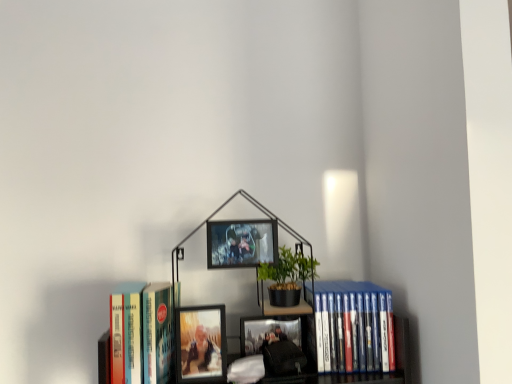
The image size is (512, 384). What do you see at coordinates (353, 327) in the screenshot? I see `blue plastic dvds at right, which is the second book from left to right` at bounding box center [353, 327].

What is the approximate height of matte glass photo frame at center, which ranks as the first picture frame in bottom-to-top order?

It is 14.72 centimeters.

What do you see at coordinates (141, 333) in the screenshot? I see `hardcover book at left, marked as the 1th book in a left-to-right arrangement` at bounding box center [141, 333].

What are the coordinates of `blue plastic dvds at right, which is the second book from left to right` in the screenshot? It's located at (353, 327).

Considering the relative sizes of hardcover book at left, marked as the 1th book in a left-to-right arrangement, and blue plastic dvds at right, the first book in the right-to-left sequence, in the image provided, is hardcover book at left, marked as the 1th book in a left-to-right arrangement, bigger than blue plastic dvds at right, the first book in the right-to-left sequence,?

Yes, hardcover book at left, marked as the 1th book in a left-to-right arrangement, is bigger than blue plastic dvds at right, the first book in the right-to-left sequence.

Does hardcover book at left, placed as the second book when sorted from right to left, appear on the right side of blue plastic dvds at right, which is the second book from left to right?

In fact, hardcover book at left, placed as the second book when sorted from right to left, is to the left of blue plastic dvds at right, which is the second book from left to right.

From a real-world perspective, is hardcover book at left, marked as the 1th book in a left-to-right arrangement, physically located above or below blue plastic dvds at right, the first book in the right-to-left sequence?

hardcover book at left, marked as the 1th book in a left-to-right arrangement, is above blue plastic dvds at right, the first book in the right-to-left sequence.

What's the angular difference between hardcover book at left, placed as the second book when sorted from right to left, and blue plastic dvds at right, the first book in the right-to-left sequence,'s facing directions?

They differ by 5.55 degrees in their facing directions.

Is hardcover book at left, placed as the second book when sorted from right to left, not close to matte glass photo frame at center, the 2th picture frame in the top-to-bottom sequence?

Actually, hardcover book at left, placed as the second book when sorted from right to left, and matte glass photo frame at center, the 2th picture frame in the top-to-bottom sequence, are a little close together.

Is hardcover book at left, marked as the 1th book in a left-to-right arrangement, taller than matte glass photo frame at center, the 2th picture frame in the top-to-bottom sequence?

Indeed, hardcover book at left, marked as the 1th book in a left-to-right arrangement, has a greater height compared to matte glass photo frame at center, the 2th picture frame in the top-to-bottom sequence.

From the hardcover book at left, placed as the second book when sorted from right to left, count 1st picture frame to the right and point to it. Please provide its 2D coordinates.

[(201, 344)]

Is blue plastic dvds at right, the first book in the right-to-left sequence, positioned with its back to metallic silver picture frame at center, marked as the 2th picture frame in a bottom-to-top arrangement?

No, blue plastic dvds at right, the first book in the right-to-left sequence, is not facing the opposite direction of metallic silver picture frame at center, marked as the 2th picture frame in a bottom-to-top arrangement.

Is blue plastic dvds at right, the first book in the right-to-left sequence, to the right of metallic silver picture frame at center, which is the 1th picture frame from top to bottom, from the viewer's perspective?

Correct, you'll find blue plastic dvds at right, the first book in the right-to-left sequence, to the right of metallic silver picture frame at center, which is the 1th picture frame from top to bottom.

In the image, is blue plastic dvds at right, which is the second book from left to right, positioned in front of or behind metallic silver picture frame at center, which is the 1th picture frame from top to bottom?

blue plastic dvds at right, which is the second book from left to right, is positioned farther from the viewer than metallic silver picture frame at center, which is the 1th picture frame from top to bottom.

Do you think blue plastic dvds at right, the first book in the right-to-left sequence, is within metallic silver picture frame at center, marked as the 2th picture frame in a bottom-to-top arrangement, or outside of it?

blue plastic dvds at right, the first book in the right-to-left sequence, is outside metallic silver picture frame at center, marked as the 2th picture frame in a bottom-to-top arrangement.

Between matte glass photo frame at center, the 2th picture frame in the top-to-bottom sequence, and metallic silver picture frame at center, which is the 1th picture frame from top to bottom, which one has more height?

matte glass photo frame at center, the 2th picture frame in the top-to-bottom sequence.

Would you say matte glass photo frame at center, which ranks as the first picture frame in bottom-to-top order, is outside metallic silver picture frame at center, which is the 1th picture frame from top to bottom?

That's correct, matte glass photo frame at center, which ranks as the first picture frame in bottom-to-top order, is outside of metallic silver picture frame at center, which is the 1th picture frame from top to bottom.

Which is nearer, (218, 351) or (267, 238)?

Positioned in front is point (218, 351).

What's the angular difference between matte glass photo frame at center, which ranks as the first picture frame in bottom-to-top order, and metallic silver picture frame at center, marked as the 2th picture frame in a bottom-to-top arrangement,'s facing directions?

0.000105 degrees separate the facing orientations of matte glass photo frame at center, which ranks as the first picture frame in bottom-to-top order, and metallic silver picture frame at center, marked as the 2th picture frame in a bottom-to-top arrangement.

Considering the sizes of objects hardcover book at left, placed as the second book when sorted from right to left, and metallic silver picture frame at center, which is the 1th picture frame from top to bottom, in the image provided, who is taller, hardcover book at left, placed as the second book when sorted from right to left, or metallic silver picture frame at center, which is the 1th picture frame from top to bottom,?

hardcover book at left, placed as the second book when sorted from right to left.

Do you think hardcover book at left, placed as the second book when sorted from right to left, is within metallic silver picture frame at center, marked as the 2th picture frame in a bottom-to-top arrangement, or outside of it?

hardcover book at left, placed as the second book when sorted from right to left, is outside metallic silver picture frame at center, marked as the 2th picture frame in a bottom-to-top arrangement.

Relative to metallic silver picture frame at center, which is the 1th picture frame from top to bottom, is hardcover book at left, placed as the second book when sorted from right to left, in front or behind?

hardcover book at left, placed as the second book when sorted from right to left, is in front of metallic silver picture frame at center, which is the 1th picture frame from top to bottom.

Between matte glass photo frame at center, the 2th picture frame in the top-to-bottom sequence, and hardcover book at left, placed as the second book when sorted from right to left, which one has larger size?

Bigger between the two is hardcover book at left, placed as the second book when sorted from right to left.

Is matte glass photo frame at center, which ranks as the first picture frame in bottom-to-top order, aimed at hardcover book at left, marked as the 1th book in a left-to-right arrangement?

No, matte glass photo frame at center, which ranks as the first picture frame in bottom-to-top order, is not aimed at hardcover book at left, marked as the 1th book in a left-to-right arrangement.

Visually, is matte glass photo frame at center, which ranks as the first picture frame in bottom-to-top order, positioned to the left or to the right of hardcover book at left, marked as the 1th book in a left-to-right arrangement?

Based on their positions, matte glass photo frame at center, which ranks as the first picture frame in bottom-to-top order, is located to the right of hardcover book at left, marked as the 1th book in a left-to-right arrangement.

From the image's perspective, who appears lower, matte glass photo frame at center, which ranks as the first picture frame in bottom-to-top order, or hardcover book at left, placed as the second book when sorted from right to left?

From the image's view, matte glass photo frame at center, which ranks as the first picture frame in bottom-to-top order, is below.

Is blue plastic dvds at right, the first book in the right-to-left sequence, further to the viewer compared to hardcover book at left, placed as the second book when sorted from right to left?

Yes, it is behind hardcover book at left, placed as the second book when sorted from right to left.

Is blue plastic dvds at right, which is the second book from left to right, touching hardcover book at left, placed as the second book when sorted from right to left?

There is a gap between blue plastic dvds at right, which is the second book from left to right, and hardcover book at left, placed as the second book when sorted from right to left.

From the image's perspective, is blue plastic dvds at right, which is the second book from left to right, located above or below hardcover book at left, placed as the second book when sorted from right to left?

Clearly, from the image's perspective, blue plastic dvds at right, which is the second book from left to right, is above hardcover book at left, placed as the second book when sorted from right to left.

How many degrees apart are the facing directions of blue plastic dvds at right, which is the second book from left to right, and hardcover book at left, marked as the 1th book in a left-to-right arrangement?

blue plastic dvds at right, which is the second book from left to right, and hardcover book at left, marked as the 1th book in a left-to-right arrangement, are facing 5.55 degrees away from each other.

Locate an element on the screen. Image resolution: width=512 pixels, height=384 pixels. book below the hardcover book at left, placed as the second book when sorted from right to left (from a real-world perspective) is located at coordinates (353, 327).

Identify the location of book lying in front of the matte glass photo frame at center, which ranks as the first picture frame in bottom-to-top order. (141, 333).

Looking at the image, which one is located further to metallic silver picture frame at center, which is the 1th picture frame from top to bottom, hardcover book at left, placed as the second book when sorted from right to left, or blue plastic dvds at right, the first book in the right-to-left sequence?

The object further to metallic silver picture frame at center, which is the 1th picture frame from top to bottom, is blue plastic dvds at right, the first book in the right-to-left sequence.

Which object lies nearer to the anchor point matte glass photo frame at center, the 2th picture frame in the top-to-bottom sequence, metallic silver picture frame at center, marked as the 2th picture frame in a bottom-to-top arrangement, or blue plastic dvds at right, which is the second book from left to right?

Based on the image, metallic silver picture frame at center, marked as the 2th picture frame in a bottom-to-top arrangement, appears to be nearer to matte glass photo frame at center, the 2th picture frame in the top-to-bottom sequence.

Which object lies further to the anchor point blue plastic dvds at right, the first book in the right-to-left sequence, metallic silver picture frame at center, marked as the 2th picture frame in a bottom-to-top arrangement, or hardcover book at left, marked as the 1th book in a left-to-right arrangement?

Based on the image, hardcover book at left, marked as the 1th book in a left-to-right arrangement, appears to be further to blue plastic dvds at right, the first book in the right-to-left sequence.

Looking at the image, which one is located further to metallic silver picture frame at center, marked as the 2th picture frame in a bottom-to-top arrangement, blue plastic dvds at right, which is the second book from left to right, or hardcover book at left, placed as the second book when sorted from right to left?

blue plastic dvds at right, which is the second book from left to right, is further to metallic silver picture frame at center, marked as the 2th picture frame in a bottom-to-top arrangement.

Estimate the real-world distances between objects in this image. Which object is further from metallic silver picture frame at center, marked as the 2th picture frame in a bottom-to-top arrangement, matte glass photo frame at center, which ranks as the first picture frame in bottom-to-top order, or blue plastic dvds at right, which is the second book from left to right?

blue plastic dvds at right, which is the second book from left to right.

Based on their spatial positions, is blue plastic dvds at right, the first book in the right-to-left sequence, or matte glass photo frame at center, the 2th picture frame in the top-to-bottom sequence, further from hardcover book at left, placed as the second book when sorted from right to left?

blue plastic dvds at right, the first book in the right-to-left sequence, lies further to hardcover book at left, placed as the second book when sorted from right to left, than the other object.

Based on their spatial positions, is matte glass photo frame at center, which ranks as the first picture frame in bottom-to-top order, or blue plastic dvds at right, the first book in the right-to-left sequence, further from hardcover book at left, placed as the second book when sorted from right to left?

blue plastic dvds at right, the first book in the right-to-left sequence.

Considering their positions, is matte glass photo frame at center, the 2th picture frame in the top-to-bottom sequence, positioned closer to hardcover book at left, placed as the second book when sorted from right to left, than metallic silver picture frame at center, which is the 1th picture frame from top to bottom?

matte glass photo frame at center, the 2th picture frame in the top-to-bottom sequence, lies closer to hardcover book at left, placed as the second book when sorted from right to left, than the other object.

Locate an element on the screen. picture frame located between matte glass photo frame at center, which ranks as the first picture frame in bottom-to-top order, and blue plastic dvds at right, which is the second book from left to right, in the left-right direction is located at coordinates (241, 243).